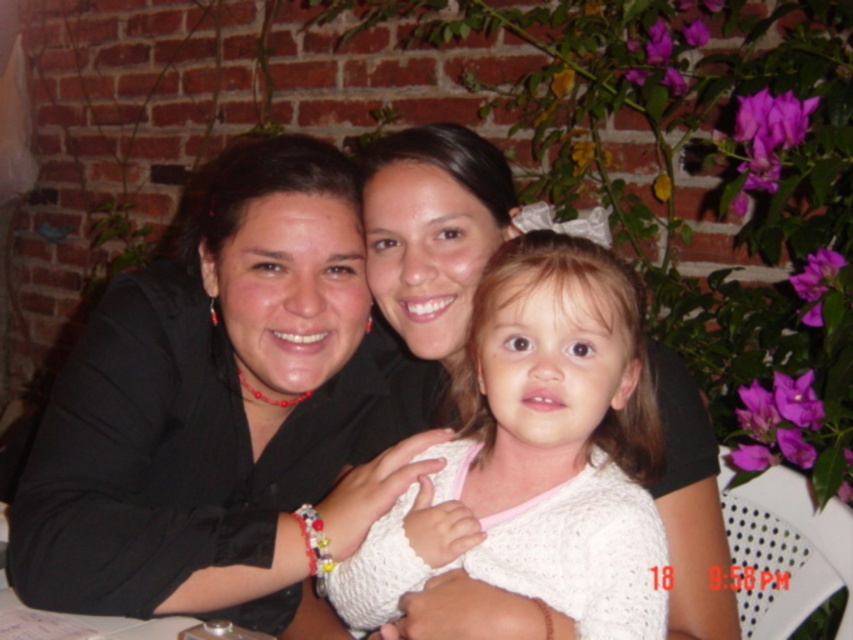
Is black matte jacket at center shorter than white knitted sweater at center?

No.

Measure the distance between black matte jacket at center and camera.

black matte jacket at center and camera are 30.22 inches apart from each other.

Where is `black matte jacket at center`? This screenshot has height=640, width=853. black matte jacket at center is located at coordinates (215, 410).